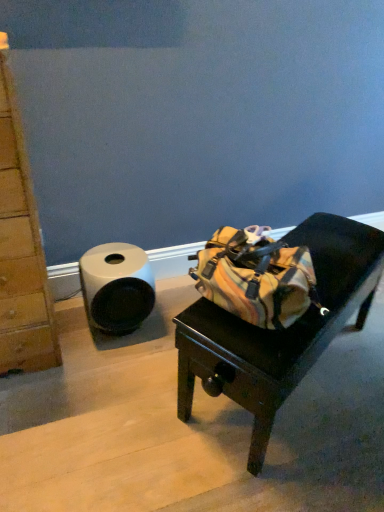
Describe the element at coordinates (116, 287) in the screenshot. This screenshot has height=512, width=384. I see `white matte toilet paper at left` at that location.

Measure the distance between white matte toilet paper at left and camera.

white matte toilet paper at left and camera are 1.57 meters apart from each other.

Identify the location of white matte toilet paper at left. Image resolution: width=384 pixels, height=512 pixels. (116, 287).

What do you see at coordinates (280, 332) in the screenshot?
I see `multicolored fabric bag at center` at bounding box center [280, 332].

You are a GUI agent. You are given a task and a screenshot of the screen. Output one action in this format:
    pyautogui.click(x=<x>, y=<y>)
    Task: Click on the multicolored fabric bag at center
    Image resolution: width=384 pixels, height=512 pixels.
    Given the screenshot: What is the action you would take?
    pyautogui.click(x=280, y=332)

I want to click on white matte toilet paper at left, so click(116, 287).

Considering the relative positions of multicolored fabric bag at center and white matte toilet paper at left in the image provided, is multicolored fabric bag at center to the left of white matte toilet paper at left from the viewer's perspective?

In fact, multicolored fabric bag at center is to the right of white matte toilet paper at left.

Relative to white matte toilet paper at left, is multicolored fabric bag at center in front or behind?

multicolored fabric bag at center is in front of white matte toilet paper at left.

Which is behind, point (351, 244) or point (94, 305)?

The point (94, 305) is behind.

From the image's perspective, between multicolored fabric bag at center and white matte toilet paper at left, who is located below?

From the image's view, multicolored fabric bag at center is below.

In the scene shown: From a real-world perspective, is multicolored fabric bag at center positioned under white matte toilet paper at left based on gravity?

No, from a real-world perspective, multicolored fabric bag at center is not under white matte toilet paper at left.

In terms of width, does multicolored fabric bag at center look wider or thinner when compared to white matte toilet paper at left?

multicolored fabric bag at center is wider than white matte toilet paper at left.

Consider the image. Between multicolored fabric bag at center and white matte toilet paper at left, which one has less height?

white matte toilet paper at left.

Looking at the image, does multicolored fabric bag at center seem bigger or smaller compared to white matte toilet paper at left?

Considering their sizes, multicolored fabric bag at center takes up more space than white matte toilet paper at left.

Would you say multicolored fabric bag at center is outside white matte toilet paper at left?

Yes, multicolored fabric bag at center is not within white matte toilet paper at left.

Based on the photo, is multicolored fabric bag at center directly adjacent to white matte toilet paper at left?

No.

Is multicolored fabric bag at center positioned with its back to white matte toilet paper at left?

Yes.

Can you tell me how much multicolored fabric bag at center and white matte toilet paper at left differ in facing direction?

The angle between the facing direction of multicolored fabric bag at center and the facing direction of white matte toilet paper at left is 27.9 degrees.

How much distance is there between multicolored fabric bag at center and white matte toilet paper at left?

multicolored fabric bag at center and white matte toilet paper at left are 20.58 inches apart from each other.

This screenshot has height=512, width=384. What are the coordinates of `toilet paper above the multicolored fabric bag at center (from the image's perspective)` in the screenshot? It's located at (116, 287).

Can you confirm if white matte toilet paper at left is positioned to the left of multicolored fabric bag at center?

Correct, you'll find white matte toilet paper at left to the left of multicolored fabric bag at center.

Which is behind, white matte toilet paper at left or multicolored fabric bag at center?

white matte toilet paper at left.

Between point (122, 266) and point (268, 351), which one is positioned behind?

The point (122, 266) is farther from the camera.

From the image's perspective, is white matte toilet paper at left below multicolored fabric bag at center?

No, from the image's perspective, white matte toilet paper at left is not beneath multicolored fabric bag at center.

From a real-world perspective, between white matte toilet paper at left and multicolored fabric bag at center, who is vertically lower?

white matte toilet paper at left is physically lower.

Does white matte toilet paper at left have a greater width compared to multicolored fabric bag at center?

No.

Considering the relative sizes of white matte toilet paper at left and multicolored fabric bag at center in the image provided, is white matte toilet paper at left shorter than multicolored fabric bag at center?

Correct, white matte toilet paper at left is not as tall as multicolored fabric bag at center.

Can you confirm if white matte toilet paper at left is bigger than multicolored fabric bag at center?

No, white matte toilet paper at left is not bigger than multicolored fabric bag at center.

Is multicolored fabric bag at center surrounded by white matte toilet paper at left?

No.

Is there a large distance between white matte toilet paper at left and multicolored fabric bag at center?

No, white matte toilet paper at left is not far from multicolored fabric bag at center.

Could you tell me if white matte toilet paper at left is facing multicolored fabric bag at center?

No.

How different are the orientations of white matte toilet paper at left and multicolored fabric bag at center in degrees?

The facing directions of white matte toilet paper at left and multicolored fabric bag at center are 27.9 degrees apart.

This screenshot has height=512, width=384. I want to click on toilet paper on the left side of multicolored fabric bag at center, so click(x=116, y=287).

You are a GUI agent. You are given a task and a screenshot of the screen. Output one action in this format:
    pyautogui.click(x=<x>, y=<y>)
    Task: Click on the furniture above the white matte toilet paper at left (from a real-world perspective)
    This screenshot has height=512, width=384.
    Given the screenshot: What is the action you would take?
    pyautogui.click(x=280, y=332)

You are a GUI agent. You are given a task and a screenshot of the screen. Output one action in this format:
    pyautogui.click(x=<x>, y=<y>)
    Task: Click on the furniture below the white matte toilet paper at left (from the image's perspective)
    The height and width of the screenshot is (512, 384).
    Given the screenshot: What is the action you would take?
    pyautogui.click(x=280, y=332)